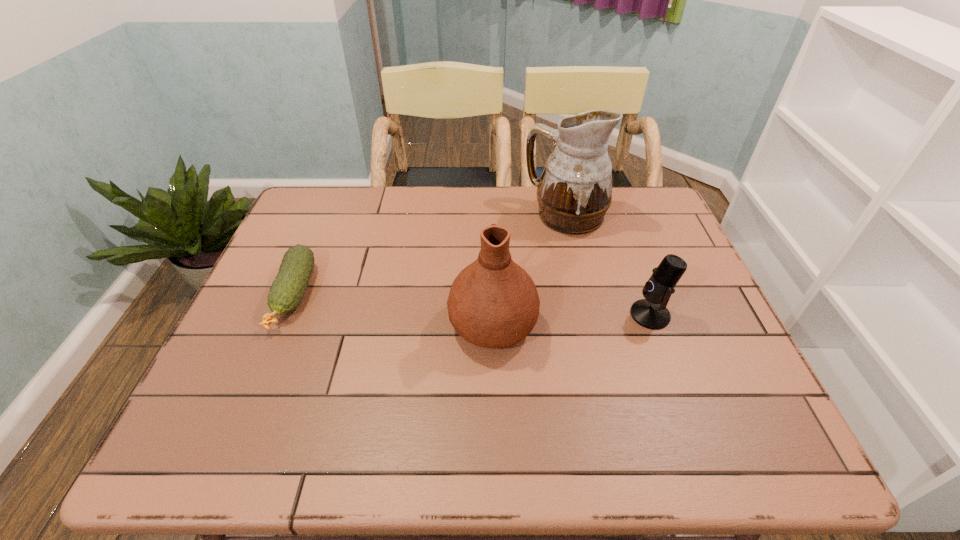
Identify the location of empty space between the shorter pitcher and the farther pitcher. (529, 269).

In order to click on vacant region between the leftmost object and the second object from left to right in this screenshot , I will do `click(394, 308)`.

Where is `vacant area that lies between the cucumber and the nearer pitcher`? vacant area that lies between the cucumber and the nearer pitcher is located at coordinates (394, 308).

This screenshot has height=540, width=960. Identify the location of unoccupied area between the microphone and the farthest object. (608, 265).

Where is `object that is the second closest to the third shortest object`? This screenshot has width=960, height=540. object that is the second closest to the third shortest object is located at coordinates (651, 312).

Locate an element on the screen. This screenshot has width=960, height=540. object that is the second closest to the nearer pitcher is located at coordinates (651, 312).

In order to click on vacant space that satisfies the following two spatial constraints: 1. from the spout of the right pitcher; 2. at the blossom end of the cucumber in this screenshot , I will do `click(584, 295)`.

You are a GUI agent. You are given a task and a screenshot of the screen. Output one action in this format:
    pyautogui.click(x=<x>, y=<y>)
    Task: Click on the free space in the image that satisfies the following two spatial constraints: 1. from the spout of the farther pitcher; 2. at the blossom end of the leftmost object
    This screenshot has height=540, width=960.
    Given the screenshot: What is the action you would take?
    (x=584, y=295)